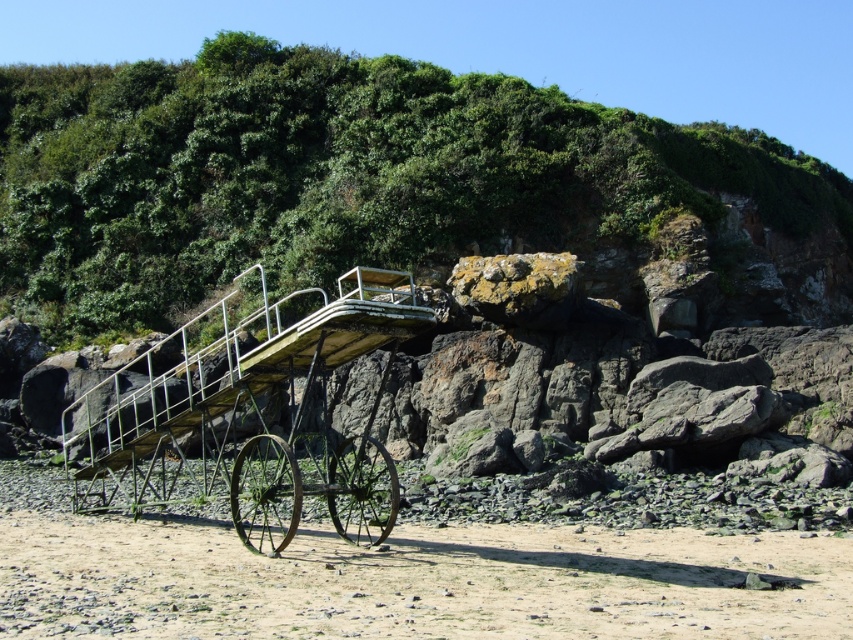
Does point (115, 234) lie behind point (352, 452)?

Yes, point (115, 234) is farther from viewer.

Which is more to the right, green leafy vegetation at upper center or green metal cart at center?

green leafy vegetation at upper center is more to the right.

Describe the element at coordinates (334, 176) in the screenshot. Image resolution: width=853 pixels, height=640 pixels. I see `green leafy vegetation at upper center` at that location.

This screenshot has height=640, width=853. Find the location of `green leafy vegetation at upper center`. green leafy vegetation at upper center is located at coordinates (334, 176).

Is green leafy vegetation at upper center behind brown sandy beach at lower center?

Yes, it is.

Does green leafy vegetation at upper center have a larger size compared to brown sandy beach at lower center?

Indeed, green leafy vegetation at upper center has a larger size compared to brown sandy beach at lower center.

This screenshot has width=853, height=640. Identify the location of green leafy vegetation at upper center. (334, 176).

Which is more to the left, brown sandy beach at lower center or green metal cart at center?

green metal cart at center is more to the left.

Between point (22, 632) and point (305, 406), which one is positioned behind?

Point (305, 406)

Image resolution: width=853 pixels, height=640 pixels. What are the coordinates of `brown sandy beach at lower center` in the screenshot? It's located at (415, 580).